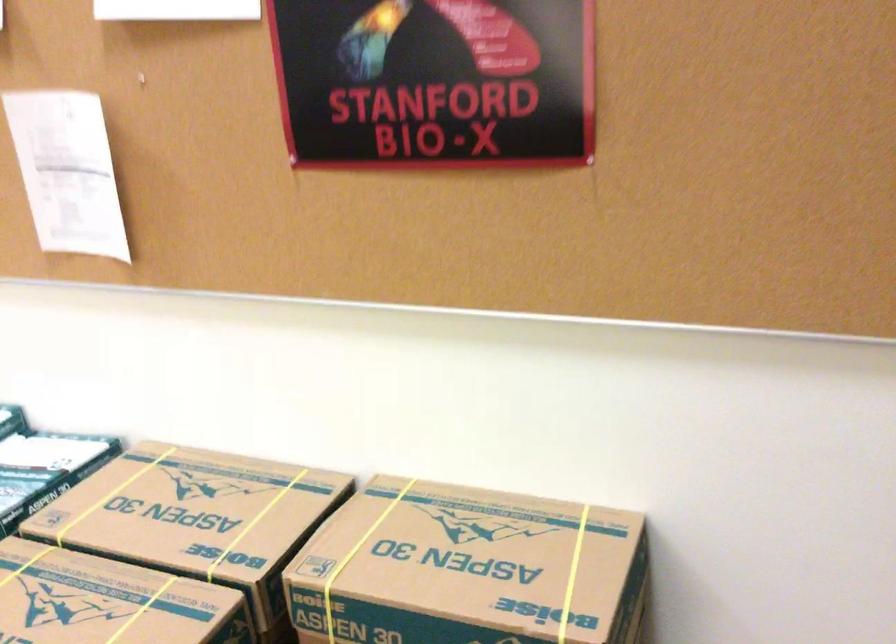
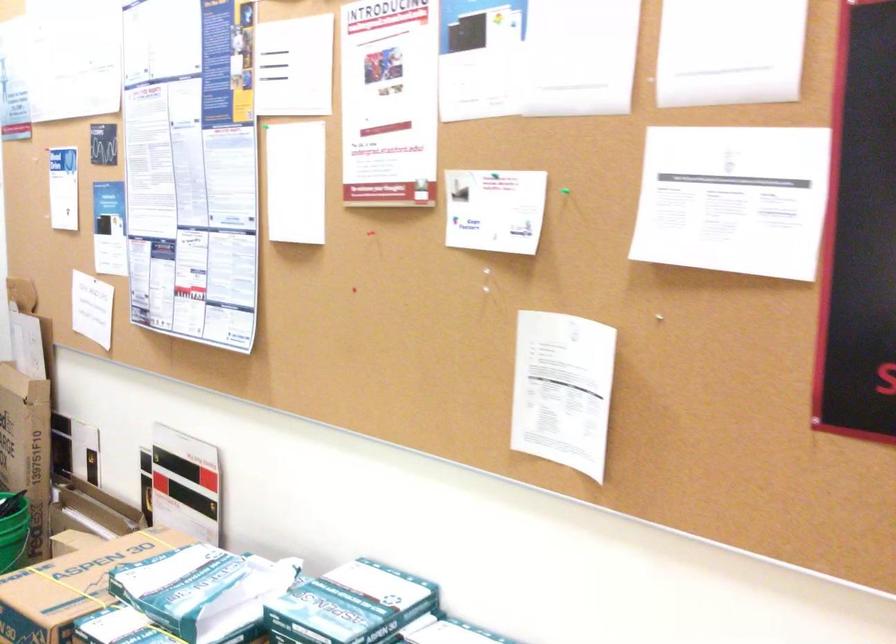
Question: The camera is either moving clockwise (left) or counter-clockwise (right) around the object. The first image is from the beginning of the video and the second image is from the end. Is the camera moving left or right when shooting the video?

Choices:
 (A) Left
 (B) Right

Answer: (B)